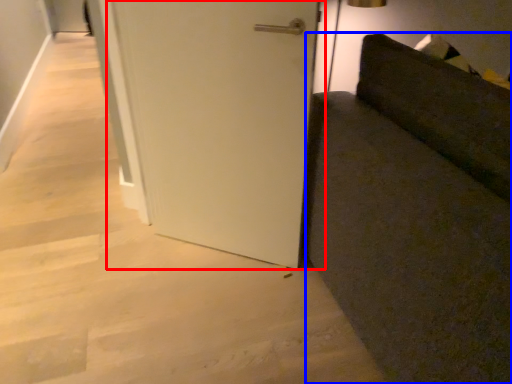
Question: Among these objects, which one is nearest to the camera, door (highlighted by a red box) or furniture (highlighted by a blue box)?

Choices:
 (A) door
 (B) furniture

Answer: (B)